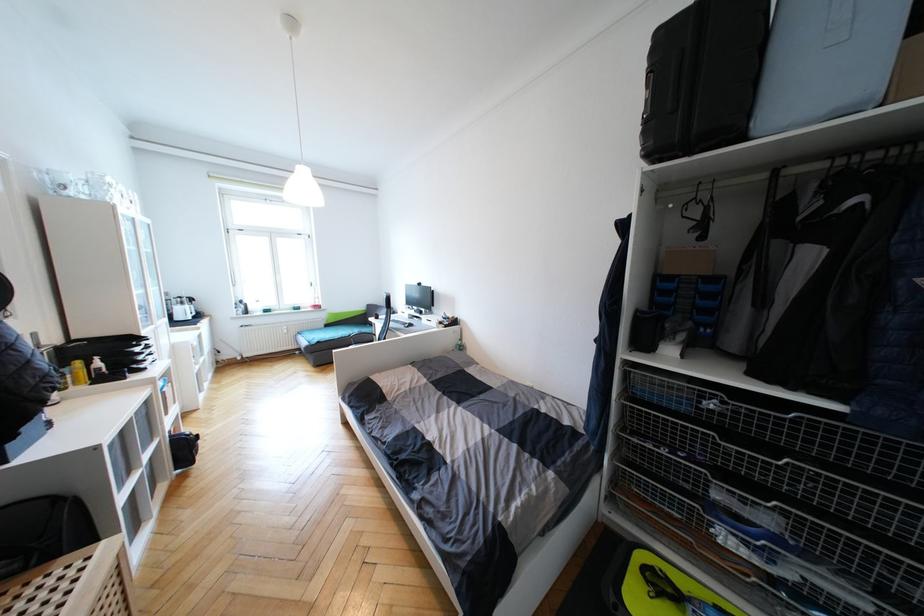
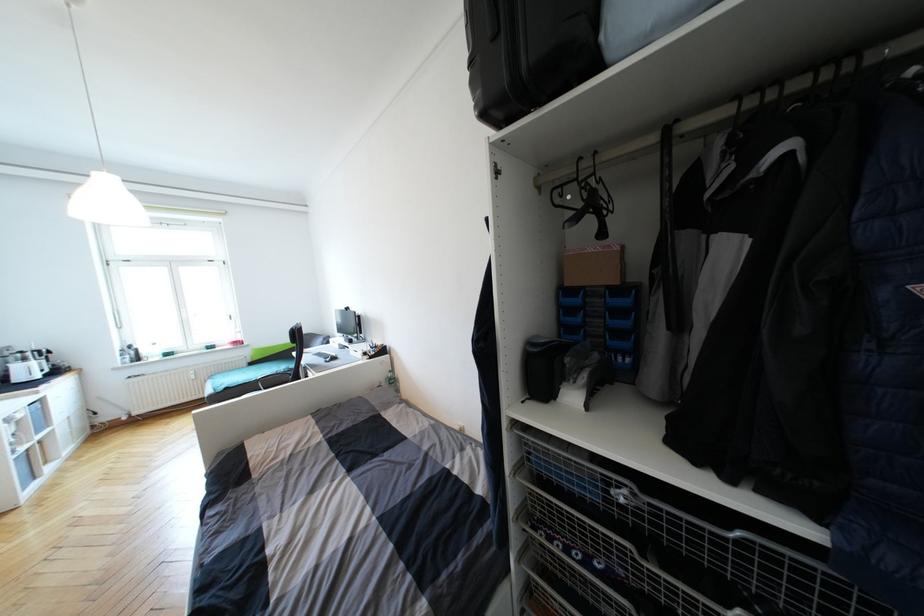
Where in the second image is the point corresponding to (x=702, y=392) from the first image?

(604, 476)